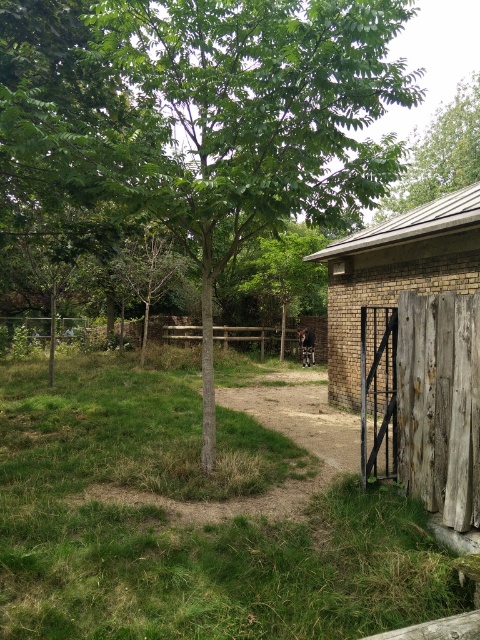
Question: Is green leafy tree at center above brown furry animal at center?

Choices:
 (A) no
 (B) yes

Answer: (B)

Question: Considering the real-world distances, which object is farthest from the brown brick barn at upper right?

Choices:
 (A) green leafy tree at center
 (B) green leafy tree at upper center
 (C) green grass at lower left

Answer: (B)

Question: Which object is the closest to the green grass at lower left?

Choices:
 (A) brown furry animal at center
 (B) green leafy tree at upper center

Answer: (A)

Question: Does green leafy tree at center have a lesser width compared to brown furry animal at center?

Choices:
 (A) no
 (B) yes

Answer: (A)

Question: Is green grass at lower left bigger than green leafy tree at upper center?

Choices:
 (A) no
 (B) yes

Answer: (B)

Question: Which object is closer to the camera taking this photo?

Choices:
 (A) green grass at lower left
 (B) green leafy tree at upper center
 (C) brown brick barn at upper right

Answer: (A)